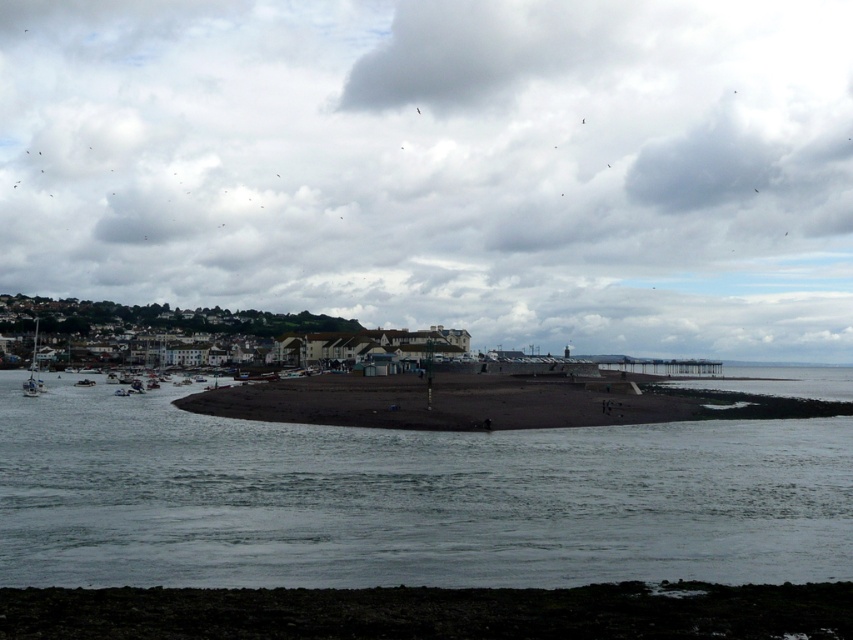
You are standing on the dark sand beach at center and want to walk to the white plastic sailboat at left. Considering the beach is narrower than the boat, will you have enough space to walk around the boat without stepping into the water?

The dark sand beach at center is narrower than the white plastic sailboat at left, so the beach might not provide enough space to walk around the boat without getting close to the water. You may need to take caution or choose a different path.

You are standing on the dark sand beach at center and want to reach the dark sand at lower center. Which direction should you move to get there?

You should move upwards towards the dark sand at lower center because it is positioned over the dark sand beach at center.